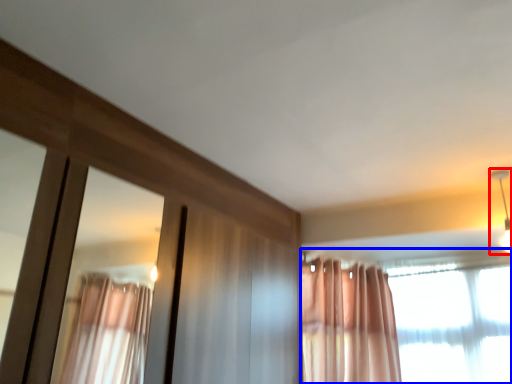
Question: Which object is further to the camera taking this photo, light fixture (highlighted by a red box) or curtain (highlighted by a blue box)?

Choices:
 (A) light fixture
 (B) curtain

Answer: (A)